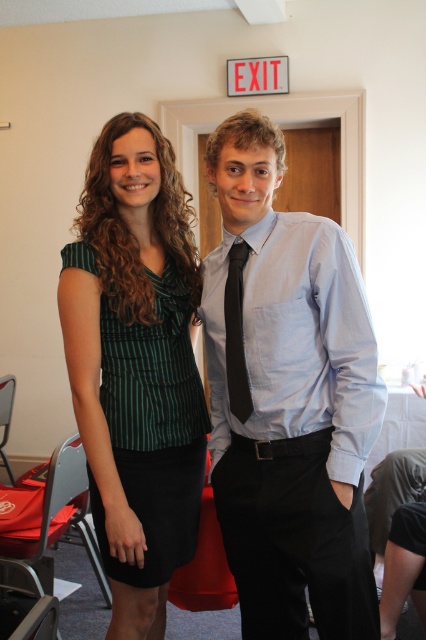
You are standing at the point with coordinates (287, 397) in the image. What object is located exactly at this point?

The light blue shirt at center is located exactly at the point with coordinates (287, 397).

You are a photographer at a party and need to adjust the camera focus. The two people in the image are wearing a light blue shirt at center and a green striped blouse at center. Which one is closer to the camera?

The light blue shirt at center and green striped blouse at center are 9.01 inches apart, but without additional depth cues, it is impossible to determine which is closer to the camera based solely on their distance apart.